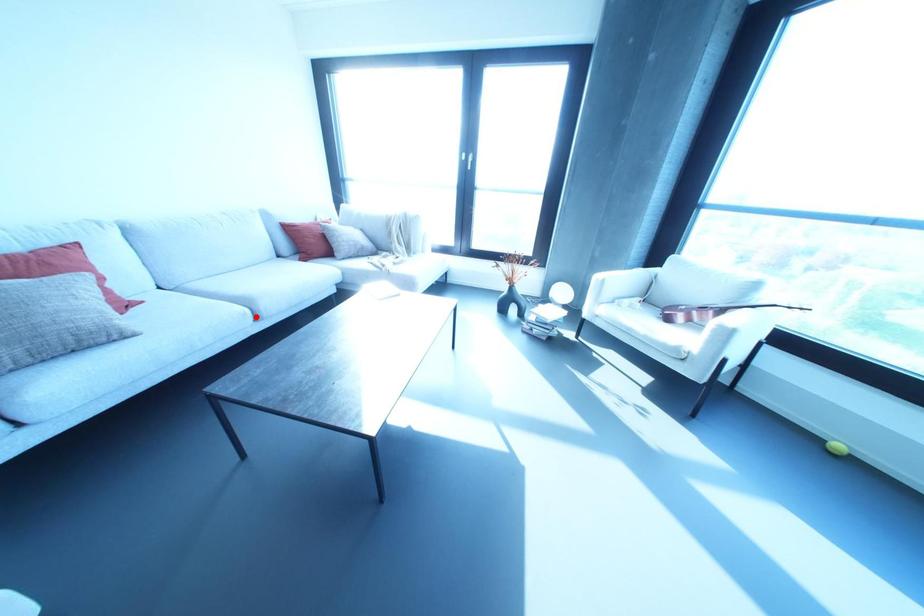
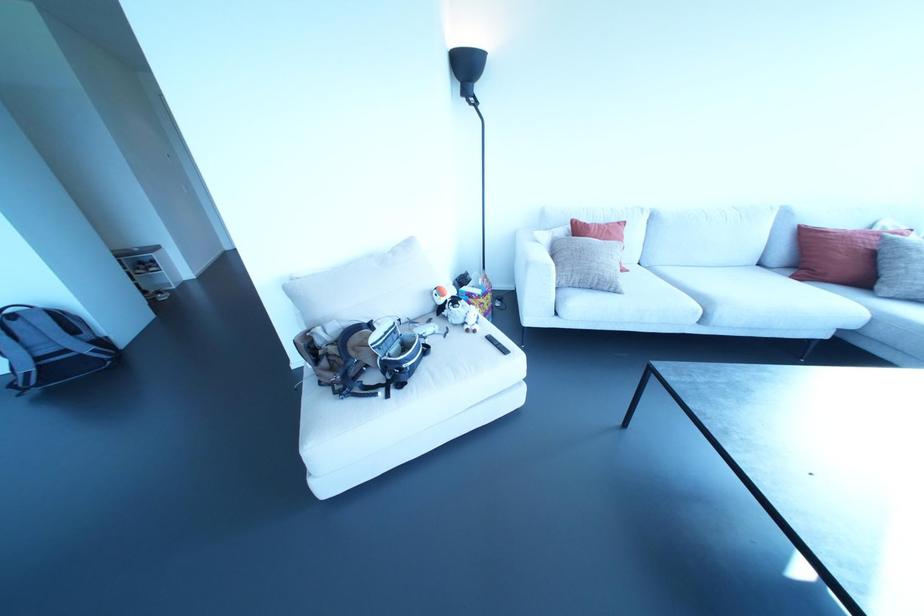
Question: I am providing you with two images of the same scene from different viewpoints. In image1, a red point is highlighted. Considering the same 3D point in image2, which of the following is correct?

Choices:
 (A) It is closer
 (B) It is farther

Answer: (B)